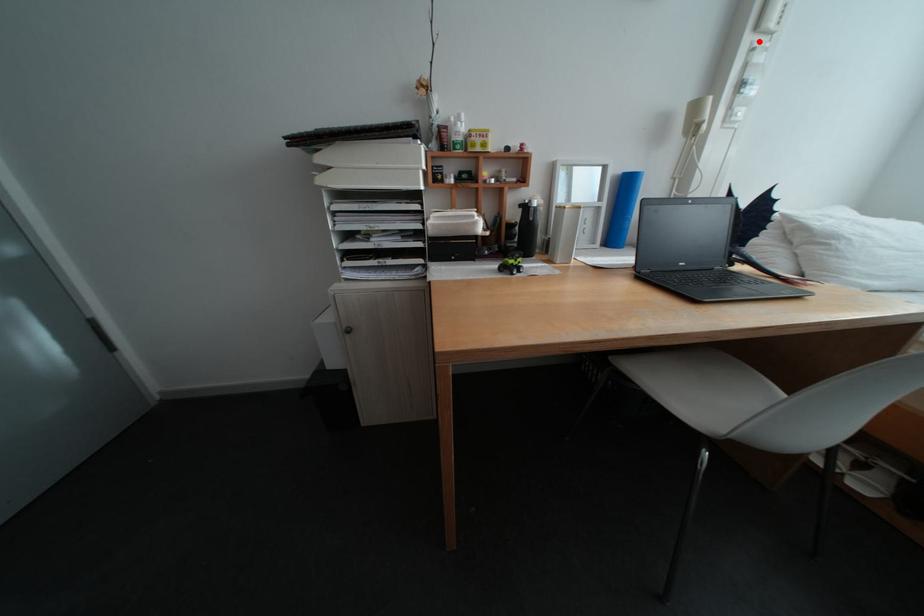
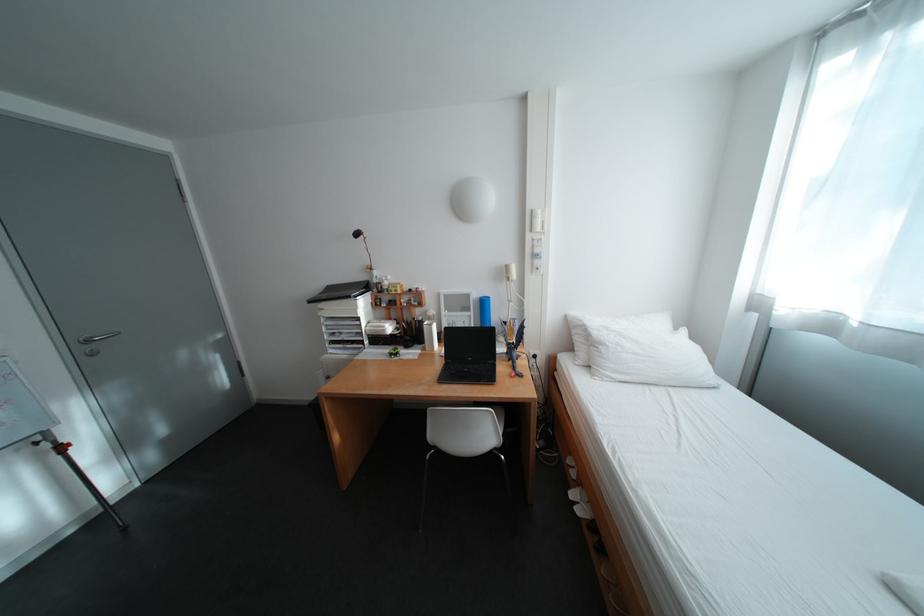
Question: A red point is marked in image1. In image2, is the corresponding 3D point closer to the camera or farther? Reply with the corresponding letter.

Choices:
 (A) The corresponding 3D point is closer.
 (B) The corresponding 3D point is farther.

Answer: (A)